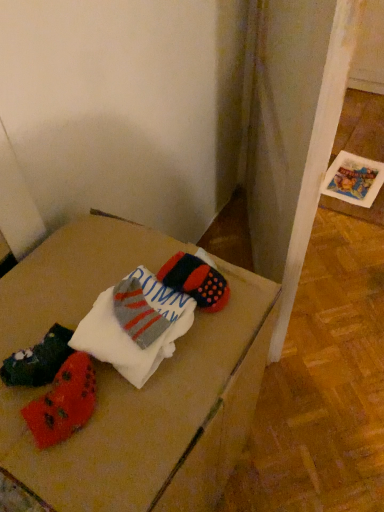
Question: Is point (147, 322) closer or farther from the camera than point (49, 242)?

Choices:
 (A) farther
 (B) closer

Answer: (B)

Question: Choose the correct answer: Is white cotton socks at center inside wooden table at center or outside it?

Choices:
 (A) inside
 (B) outside

Answer: (A)

Question: Looking at their shapes, would you say white cotton socks at center is wider or thinner than wooden table at center?

Choices:
 (A) wide
 (B) thin

Answer: (B)

Question: From the image's perspective, is wooden table at center positioned above or below white cotton socks at center?

Choices:
 (A) above
 (B) below

Answer: (B)

Question: Is wooden table at center bigger or smaller than white cotton socks at center?

Choices:
 (A) small
 (B) big

Answer: (B)

Question: From a real-world perspective, is wooden table at center above or below white cotton socks at center?

Choices:
 (A) below
 (B) above

Answer: (A)

Question: Would you say wooden table at center is to the left or to the right of white cotton socks at center in the picture?

Choices:
 (A) left
 (B) right

Answer: (A)